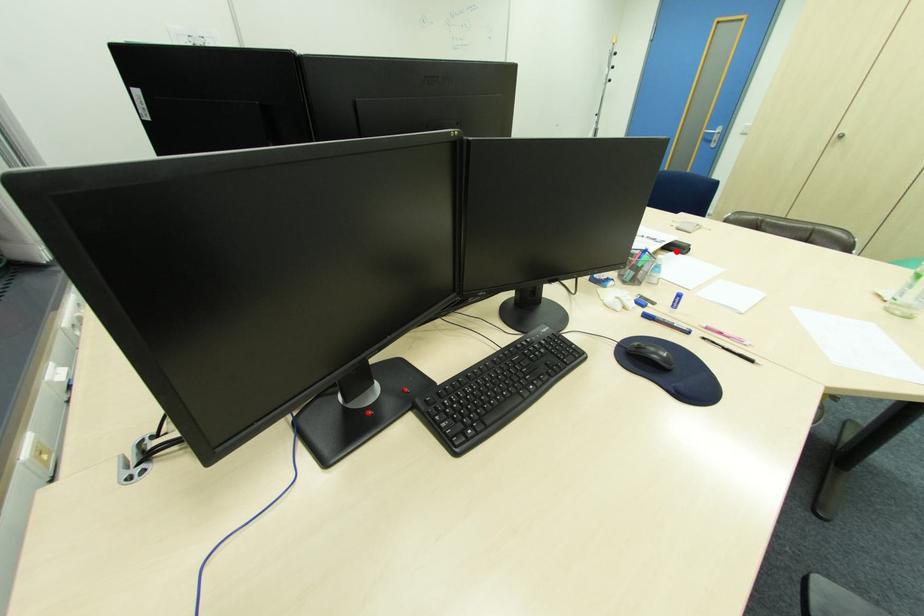
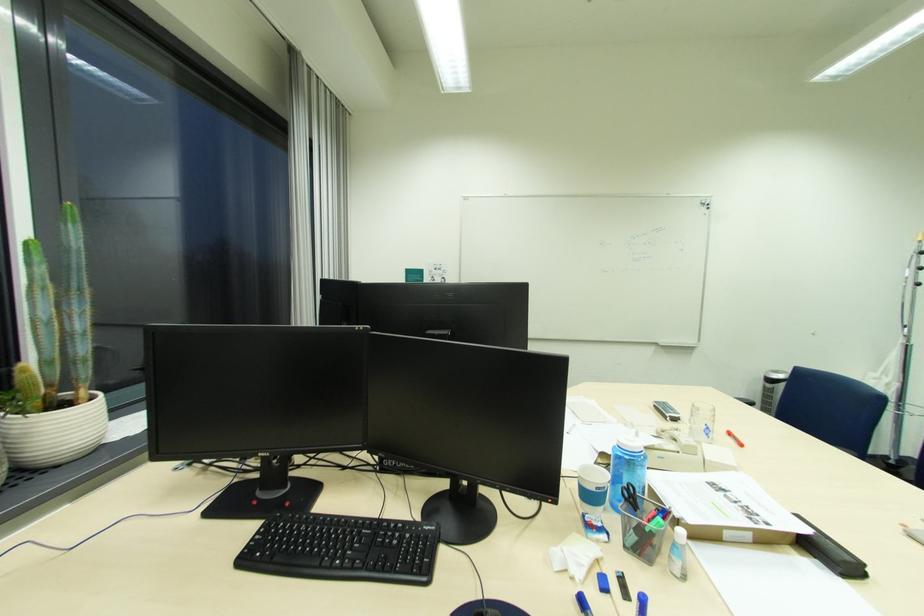
Where in the second image is the point corresponding to the highlighted location from the first image?

(821, 557)